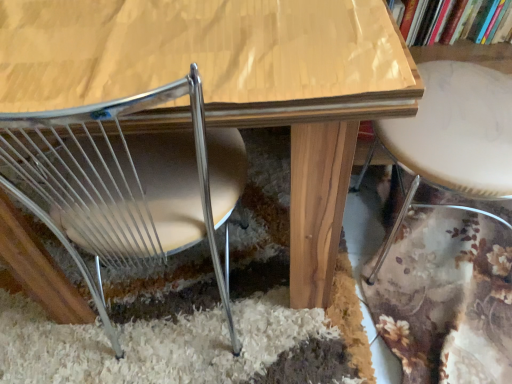
Find the location of `free space below white marble bar stool at right (from a real-world perspective)`. free space below white marble bar stool at right (from a real-world perspective) is located at coordinates (448, 246).